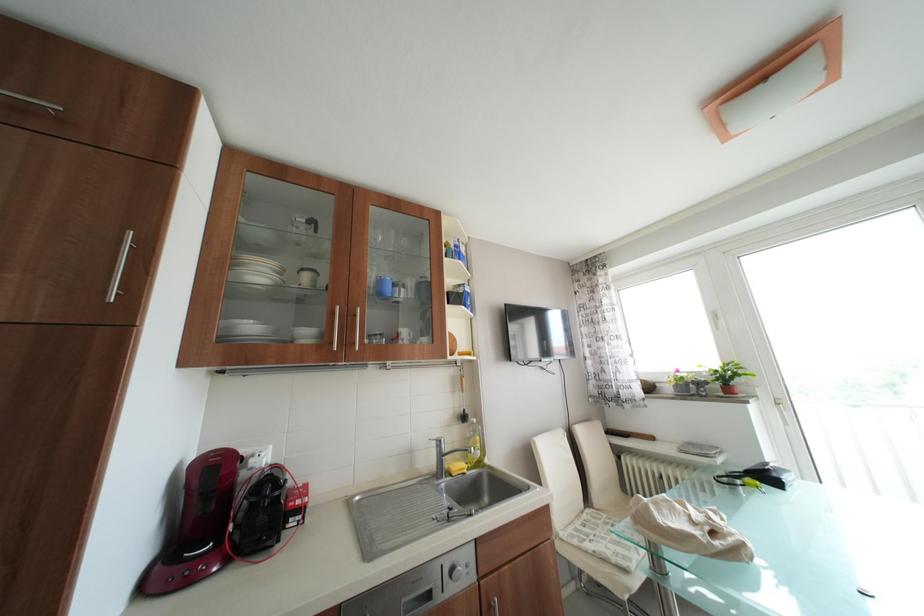
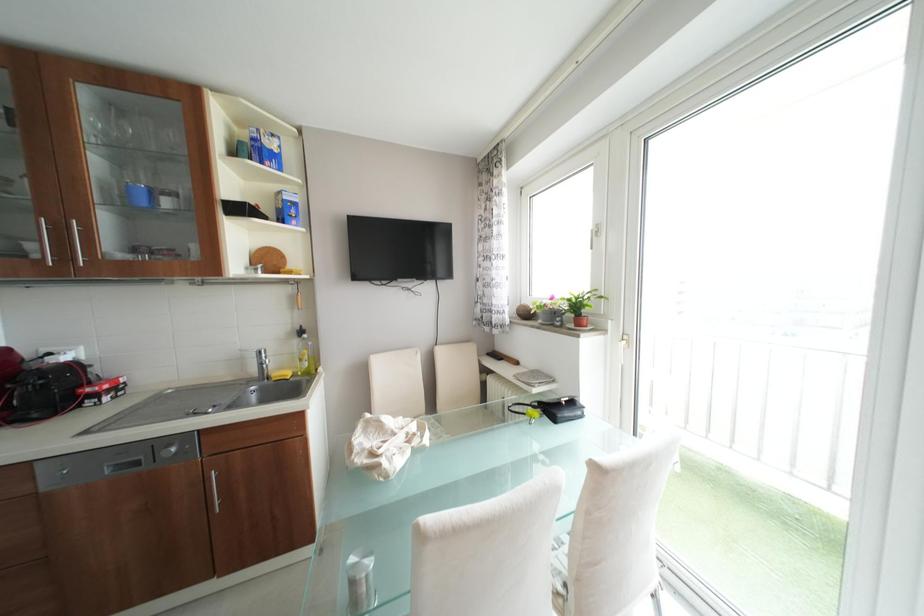
Question: Which direction would the cameraman need to move to produce the second image? Reply with the corresponding letter.

Choices:
 (A) Left
 (B) Right
 (C) Forward
 (D) Backward

Answer: (B)